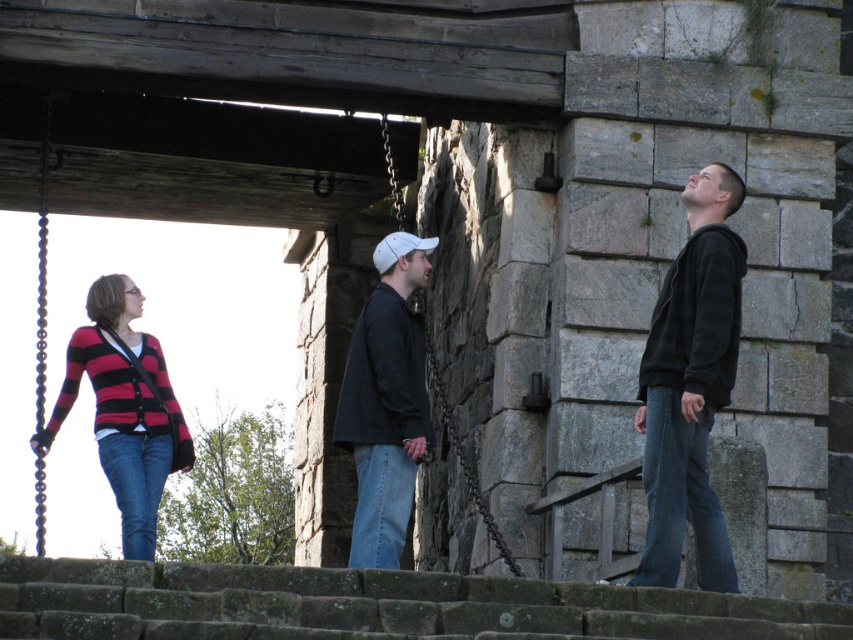
Is dark gray sweater at center shorter than blue denim jeans at right?

Incorrect, dark gray sweater at center's height does not fall short of blue denim jeans at right's.

Is point (415, 260) farther from viewer compared to point (647, 428)?

That is True.

Find the location of `dark gray sweater at center`. dark gray sweater at center is located at coordinates (386, 403).

Is point (137, 516) positioned before point (126, 460)?

No, it is behind (126, 460).

Which is below, striped knit cardigan at left or denim at left?

denim at left is below.

What do you see at coordinates (125, 408) in the screenshot? This screenshot has height=640, width=853. I see `striped knit cardigan at left` at bounding box center [125, 408].

Image resolution: width=853 pixels, height=640 pixels. What are the coordinates of `striped knit cardigan at left` in the screenshot? It's located at (125, 408).

Who is more forward, (x=396, y=355) or (x=138, y=531)?

Point (x=396, y=355)

The image size is (853, 640). Describe the element at coordinates (386, 403) in the screenshot. I see `dark gray sweater at center` at that location.

What are the coordinates of `dark gray sweater at center` in the screenshot? It's located at (386, 403).